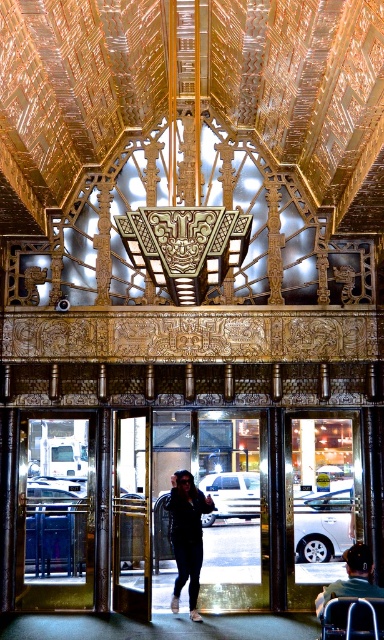
Question: Does transparent glass door at left appear over dark gray fabric wheelchair at lower right?

Choices:
 (A) no
 (B) yes

Answer: (A)

Question: Which point is farther from the camera taking this photo?

Choices:
 (A) (178, 541)
 (B) (362, 552)

Answer: (A)

Question: Can you confirm if dark blue jeans at center is wider than dark gray fabric wheelchair at lower right?

Choices:
 (A) no
 (B) yes

Answer: (B)

Question: Which of the following is the closest to the observer?

Choices:
 (A) (49, 484)
 (B) (208, 506)
 (C) (347, 566)

Answer: (C)

Question: Does transparent glass door at left have a greater width compared to dark blue jeans at center?

Choices:
 (A) no
 (B) yes

Answer: (B)

Question: Among these objects, which one is farthest from the camera?

Choices:
 (A) dark gray fabric wheelchair at lower right
 (B) transparent glass door at left

Answer: (B)